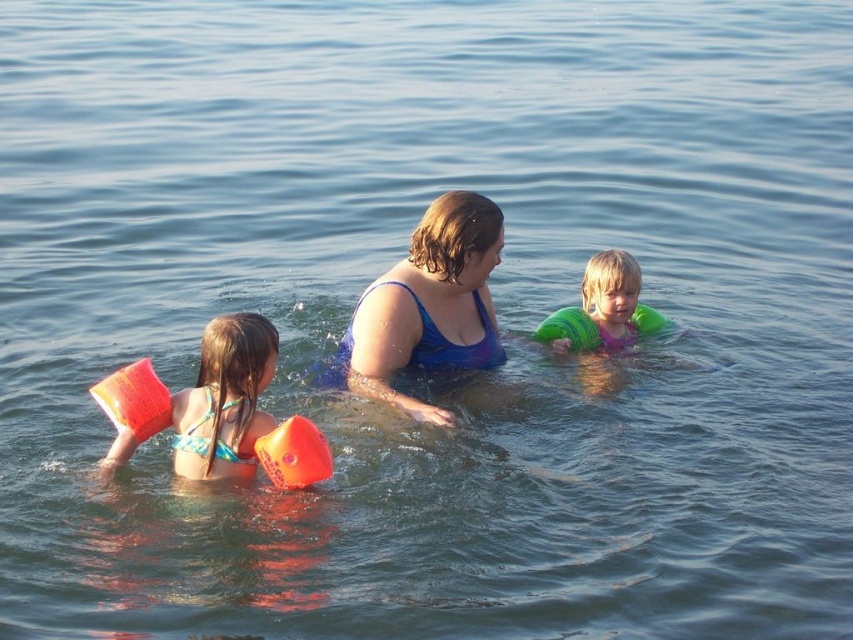
You are a swim instructor observing the scene. You notice the matte orange floaties at left and the green rubber life jacket at center. Which flotation device is located to the left of the other?

The matte orange floaties at left are positioned on the left side of the green rubber life jacket at center.

Consider the image. You are a swim instructor observing the scene. You notice the orange rubber arm float at left and the green rubber life jacket at center. Which of these two items is located below the other?

The orange rubber arm float at left is positioned under the green rubber life jacket at center.

You are a lifeguard on duty and need to reach an object floating in the water. You see the blue fabric swimsuit at center and the orange rubber arm float at lower left. Which one can you reach first if you start swimming directly towards both at the same time?

The orange rubber arm float at lower left can be reached first because it is closer to the lifeguard than the blue fabric swimsuit at center, which is 3.82 meters away.